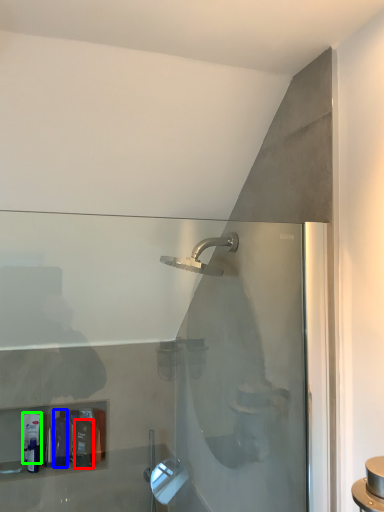
Question: Which is farther away from toiletry (highlighted by a red box)? toiletry (highlighted by a blue box) or toiletry (highlighted by a green box)?

Choices:
 (A) toiletry
 (B) toiletry

Answer: (B)